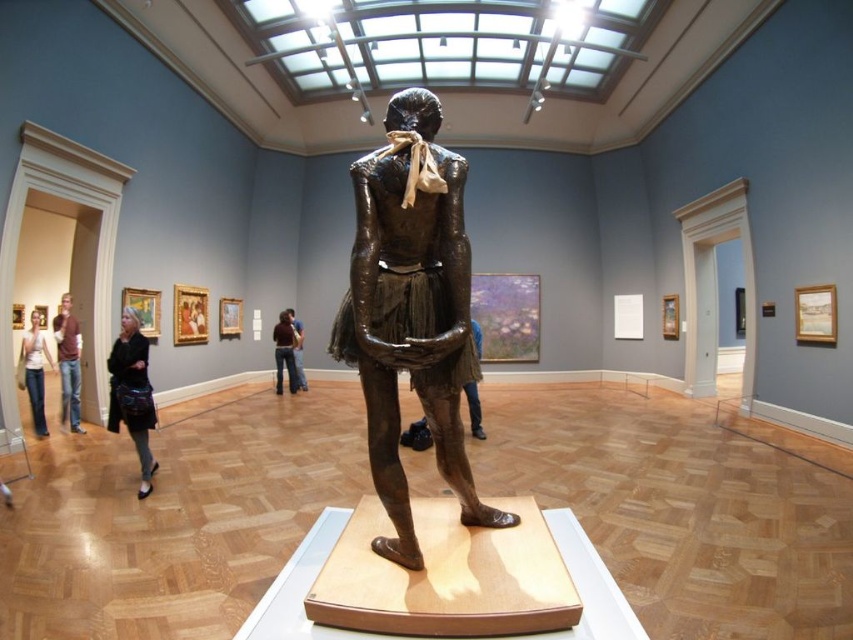
Question: Which of the following is the farthest from the observer?

Choices:
 (A) bronze statue at center
 (B) brown leather jacket at left
 (C) denim jeans at left
 (D) dark brown leather jacket at lower left

Answer: (B)

Question: Which point is closer to the camera?

Choices:
 (A) brown leather jacket at left
 (B) dark brown leather jacket at lower left
 (C) bronze statue at center

Answer: (C)

Question: Does dark brown leather jacket at lower left appear over brown leather jacket at left?

Choices:
 (A) no
 (B) yes

Answer: (A)

Question: Can you confirm if bronze statue at center is bigger than denim jeans at left?

Choices:
 (A) no
 (B) yes

Answer: (B)

Question: Is bronze statue at center thinner than brown leather jacket at left?

Choices:
 (A) yes
 (B) no

Answer: (B)

Question: Which object is farther from the camera taking this photo?

Choices:
 (A) dark brown leather jacket at lower left
 (B) brown leather jacket at left
 (C) denim jeans at left
 (D) bronze statue at center

Answer: (B)